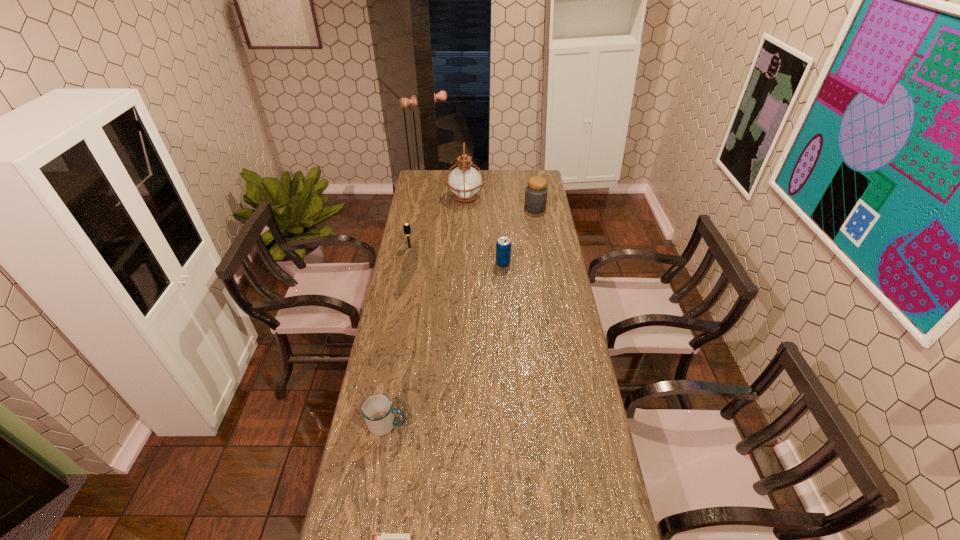
Find the location of a particular element. Image resolution: width=960 pixels, height=540 pixels. oil lamp is located at coordinates (464, 182).

Image resolution: width=960 pixels, height=540 pixels. I want to click on jar, so click(x=536, y=192).

Image resolution: width=960 pixels, height=540 pixels. In order to click on the second tallest object in this screenshot , I will do `click(536, 192)`.

This screenshot has height=540, width=960. Identify the location of hairbrush. (406, 227).

At what (x,y) coordinates should I click in order to perform the action: click on the third nearest object. Please return your answer as a coordinate pair (x, y). The height and width of the screenshot is (540, 960). Looking at the image, I should click on (503, 246).

Image resolution: width=960 pixels, height=540 pixels. In order to click on the second object from right to left in this screenshot , I will do `click(503, 246)`.

You are a GUI agent. You are given a task and a screenshot of the screen. Output one action in this format:
    pyautogui.click(x=<x>, y=<y>)
    Task: Click on the second shortest object
    This screenshot has width=960, height=540.
    Given the screenshot: What is the action you would take?
    pyautogui.click(x=377, y=409)

What are the coordinates of `the second nearest object` in the screenshot? It's located at (377, 409).

Image resolution: width=960 pixels, height=540 pixels. Find the location of `vacant space located 0.150m on the back of the tallest object`. vacant space located 0.150m on the back of the tallest object is located at coordinates (466, 174).

Identify the location of vacant region located 0.340m on the surface of the fifth shortest object near the warning symbol. (459, 208).